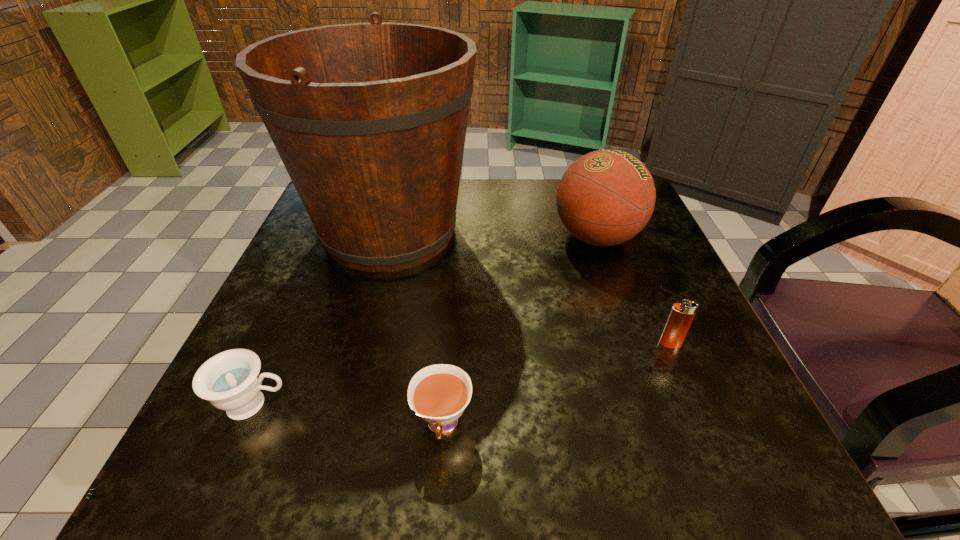
You are a GUI agent. You are given a task and a screenshot of the screen. Output one action in this format:
    pyautogui.click(x=<x>, y=<y>)
    Task: Click on the vacant space at the left edge of the desktop
    
    Given the screenshot: What is the action you would take?
    308,370

The image size is (960, 540). I want to click on free space at the right edge, so click(x=644, y=411).

Where is `free spot at the near left corner of the desktop`? free spot at the near left corner of the desktop is located at coordinates (173, 477).

Identify the location of vacant space at the near right corner of the desktop. This screenshot has height=540, width=960. (756, 428).

The image size is (960, 540). In order to click on blank region between the basketball and the bucket in this screenshot , I will do (x=493, y=234).

Locate an element on the screen. Image resolution: width=960 pixels, height=540 pixels. free space between the tallest object and the left teacup is located at coordinates (322, 318).

This screenshot has height=540, width=960. What are the coordinates of `empty location between the right teacup and the third nearest object` in the screenshot? It's located at (556, 384).

Where is `empty location between the third nearest object and the right teacup`? empty location between the third nearest object and the right teacup is located at coordinates (556, 384).

The image size is (960, 540). In order to click on vacant area that lies between the fourth shortest object and the tallest object in this screenshot , I will do `click(493, 234)`.

I want to click on vacant space in between the left teacup and the tallest object, so click(x=322, y=318).